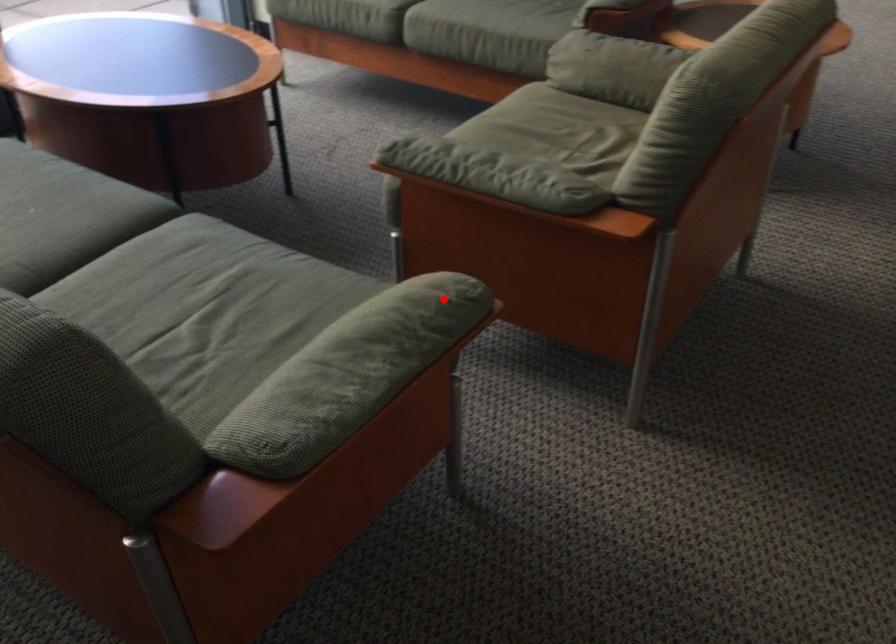
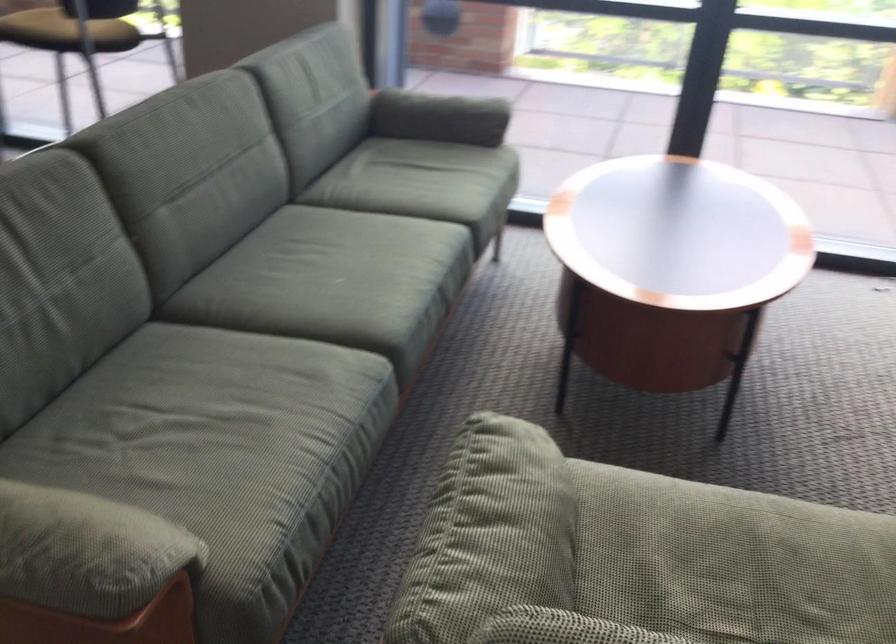
Question: A red point is marked in image1. In image2, is the corresponding 3D point closer to the camera or farther? Reply with the corresponding letter.

Choices:
 (A) The corresponding 3D point is closer.
 (B) The corresponding 3D point is farther.

Answer: (A)